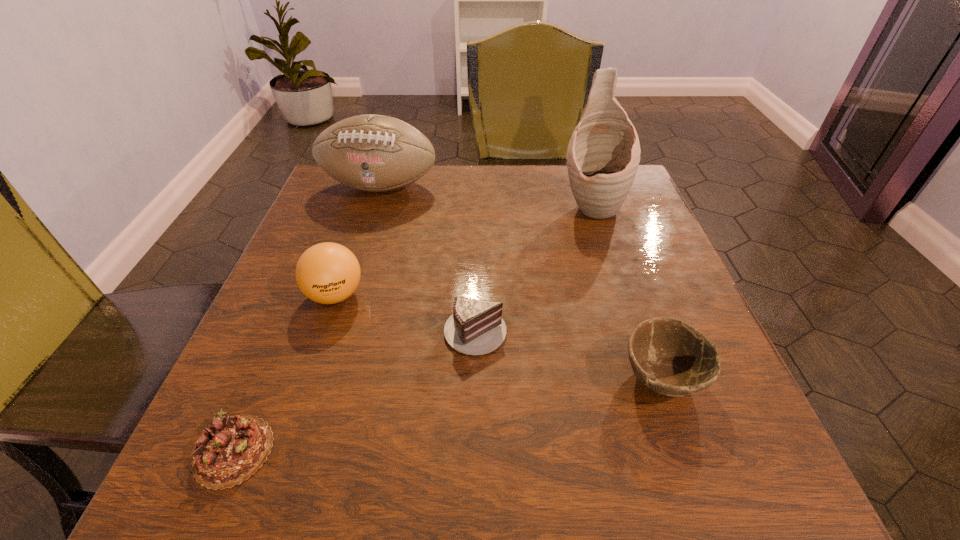
Image resolution: width=960 pixels, height=540 pixels. In order to click on blank space located on the side with brand of the ping-pong ball in this screenshot , I will do `click(318, 348)`.

At what (x,y) coordinates should I click in order to perform the action: click on vacant space positioned on the left of the bowl. Please return your answer as a coordinate pair (x, y). The height and width of the screenshot is (540, 960). Looking at the image, I should click on (386, 378).

The width and height of the screenshot is (960, 540). What are the coordinates of `blank space located 0.070m on the left of the third object from right to left` in the screenshot? It's located at (404, 329).

The image size is (960, 540). Identify the location of vacant region located 0.280m on the back of the nearer chocolate cake. (303, 284).

The image size is (960, 540). What are the coordinates of `pitcher located at the far edge` in the screenshot? It's located at (603, 155).

The width and height of the screenshot is (960, 540). Identify the location of football (American) at the far edge. (375, 153).

Where is `object that is at the near edge`? object that is at the near edge is located at coordinates (229, 451).

Where is `football (American) present at the left edge`? This screenshot has width=960, height=540. football (American) present at the left edge is located at coordinates (375, 153).

The image size is (960, 540). In order to click on ping-pong ball that is at the left edge in this screenshot , I will do click(x=327, y=273).

This screenshot has height=540, width=960. Find the location of `chocolate cake that is positioned at the left edge`. chocolate cake that is positioned at the left edge is located at coordinates (229, 451).